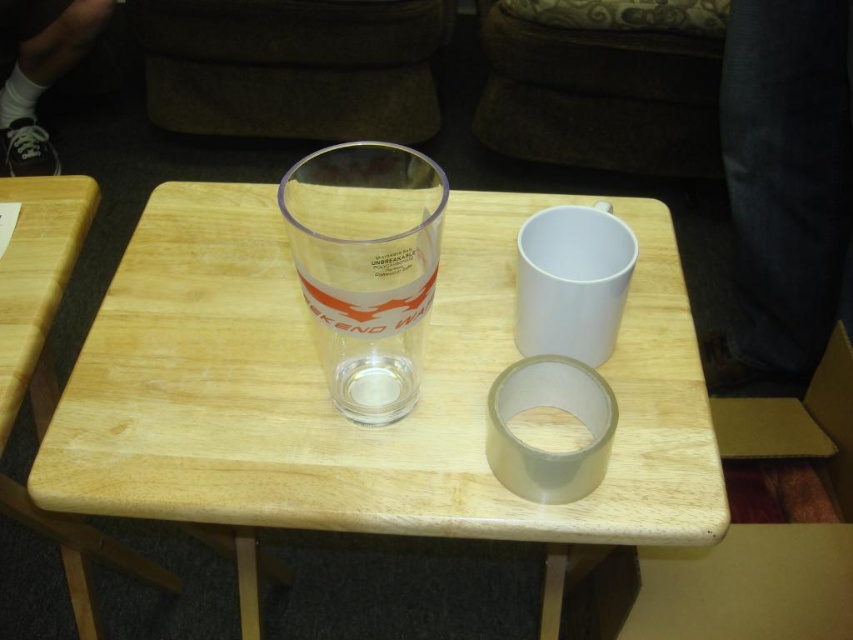
Question: Which is farther from the light wood table at left?

Choices:
 (A) clear glass shot glass at center
 (B) transparent plastic cup at center

Answer: (A)

Question: Does clear glass shot glass at center appear on the right side of light wood table at left?

Choices:
 (A) no
 (B) yes

Answer: (B)

Question: Can you confirm if clear glass shot glass at center is thinner than light wood table at left?

Choices:
 (A) yes
 (B) no

Answer: (A)

Question: Which of these objects is positioned closest to the transparent plastic cup at center?

Choices:
 (A) light wood table at left
 (B) clear glass shot glass at center

Answer: (B)

Question: Is clear glass shot glass at center thinner than light wood table at left?

Choices:
 (A) no
 (B) yes

Answer: (B)

Question: Which object is farther from the camera taking this photo?

Choices:
 (A) clear glass shot glass at center
 (B) transparent plastic cup at center
 (C) light wood table at left

Answer: (C)